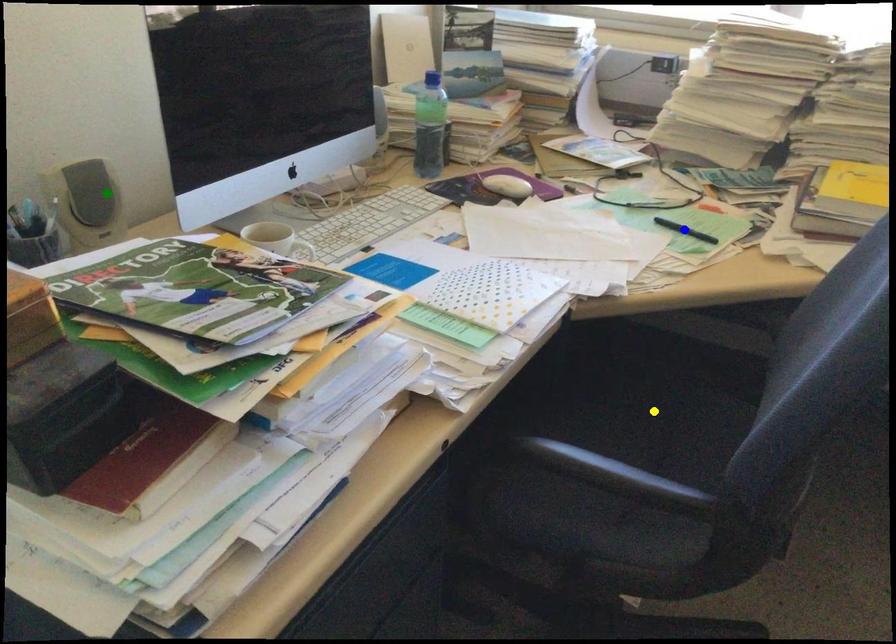
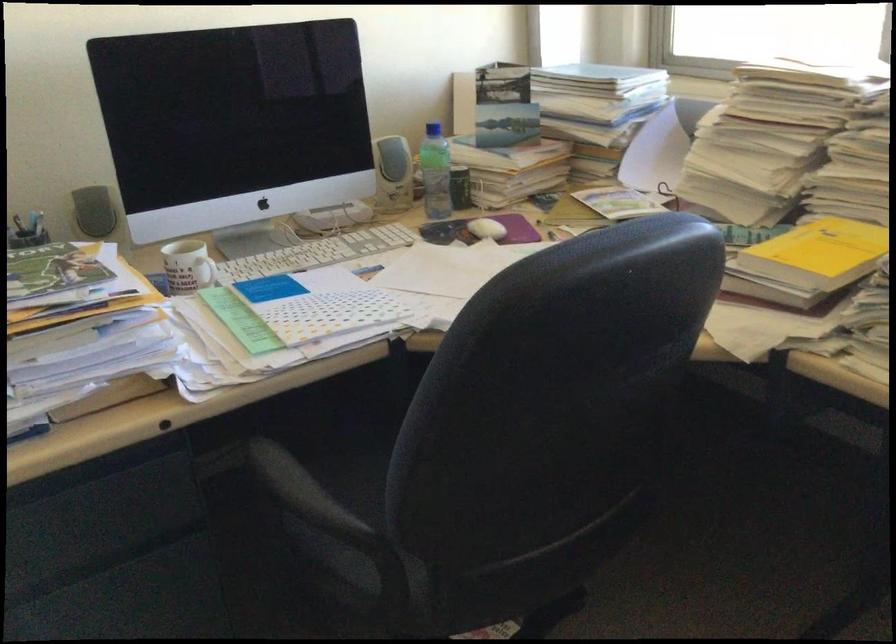
I am providing you with two images of the same scene from different viewpoints. Three points are marked in image1. Which point corresponds to a part or object that is occluded in image2?In image1, three points are marked. Which of them correspond to a part or object that is occluded in image2?Among the three points shown in image1, which one corresponds to a part or object that is no longer visible due to occlusion in image2?

Invisible in image2: yellow point, blue point.